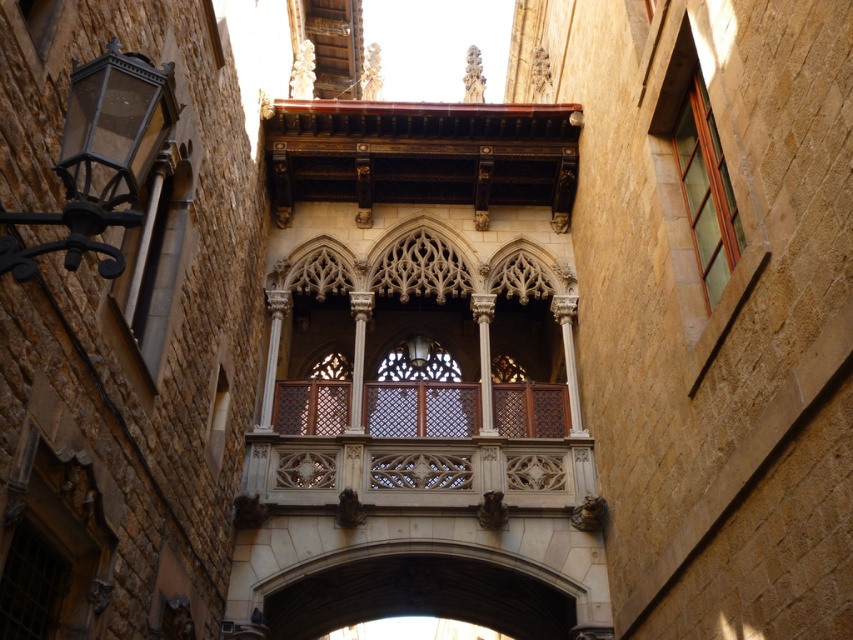
Does polished wood balcony at center appear on the right side of matte glass window at upper right?

No, polished wood balcony at center is not to the right of matte glass window at upper right.

Is polished wood balcony at center positioned in front of matte glass window at upper right?

No, it is behind matte glass window at upper right.

Does point (318, 419) lie in front of point (724, 330)?

No, it is behind (724, 330).

Find the location of a particular element. polished wood balcony at center is located at coordinates (419, 445).

Describe the element at coordinates (421, 369) in the screenshot. I see `white stone balcony at center` at that location.

Which is more to the right, white stone balcony at center or polished wood balcony at center?

Positioned to the right is polished wood balcony at center.

Where is `white stone balcony at center`? The width and height of the screenshot is (853, 640). white stone balcony at center is located at coordinates (421, 369).

Can you confirm if polished wood balcony at center is wider than matte glass lamp at center?

Correct, the width of polished wood balcony at center exceeds that of matte glass lamp at center.

How much distance is there between polished wood balcony at center and matte glass lamp at center?

The distance of polished wood balcony at center from matte glass lamp at center is 22.73 meters.

What do you see at coordinates (419, 445) in the screenshot?
I see `polished wood balcony at center` at bounding box center [419, 445].

At what (x,y) coordinates should I click in order to perform the action: click on polished wood balcony at center. Please return your answer as a coordinate pair (x, y). This screenshot has height=640, width=853. Looking at the image, I should click on (419, 445).